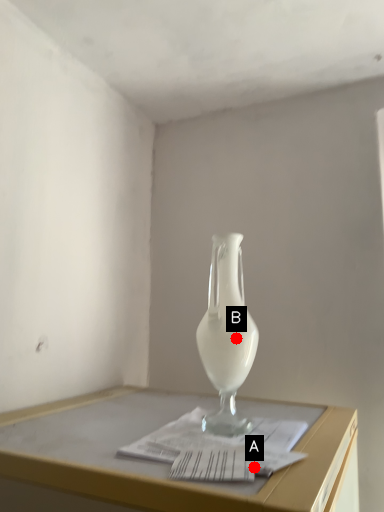
Question: Two points are circled on the image, labeled by A and B beside each circle. Which point is closer to the camera?

Choices:
 (A) A is closer
 (B) B is closer

Answer: (A)